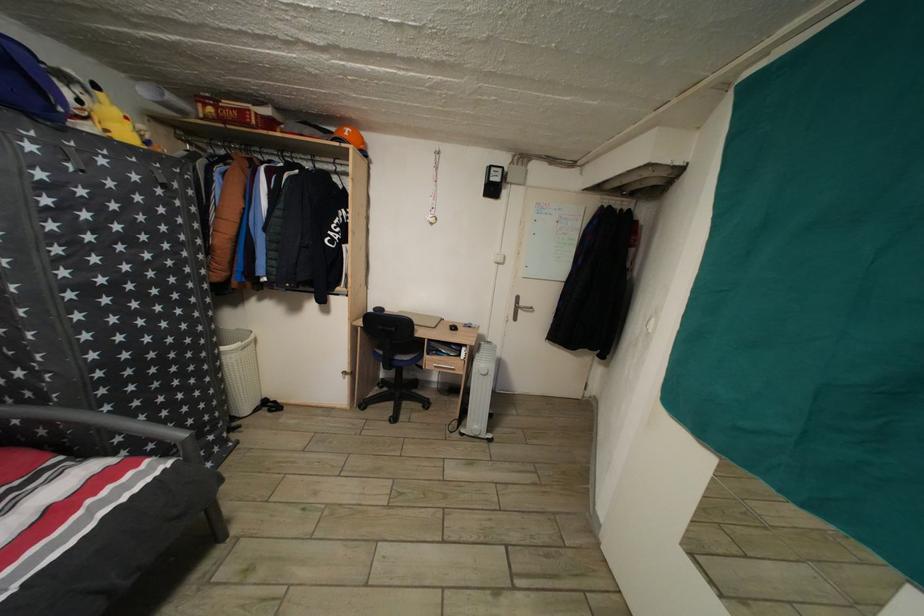
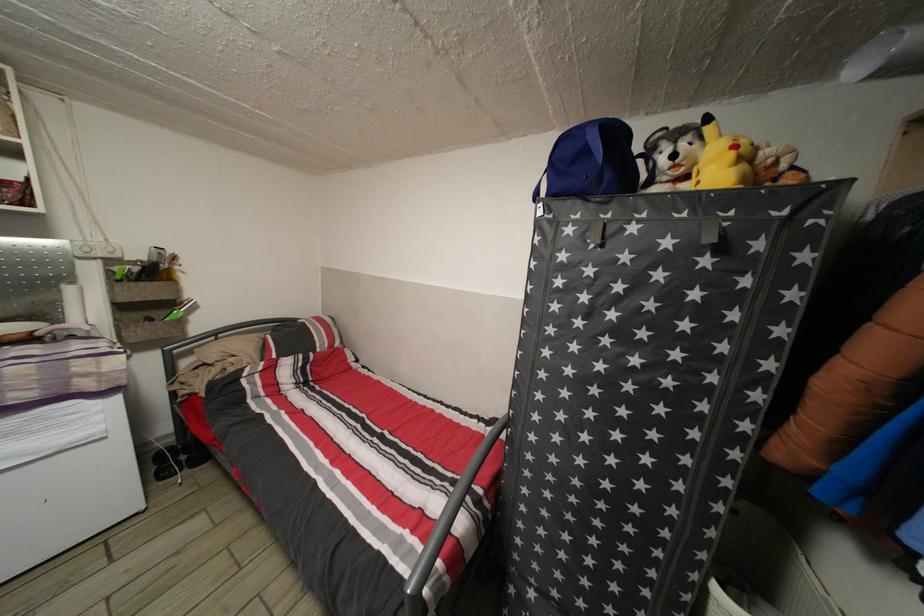
In the second image, find the point that corresponds to pixel 37 154 in the first image.

(576, 237)